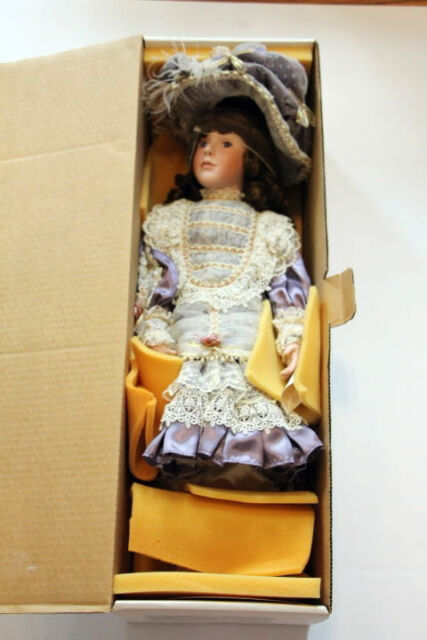
Where is `chest`? The width and height of the screenshot is (427, 640). chest is located at coordinates (217, 244).